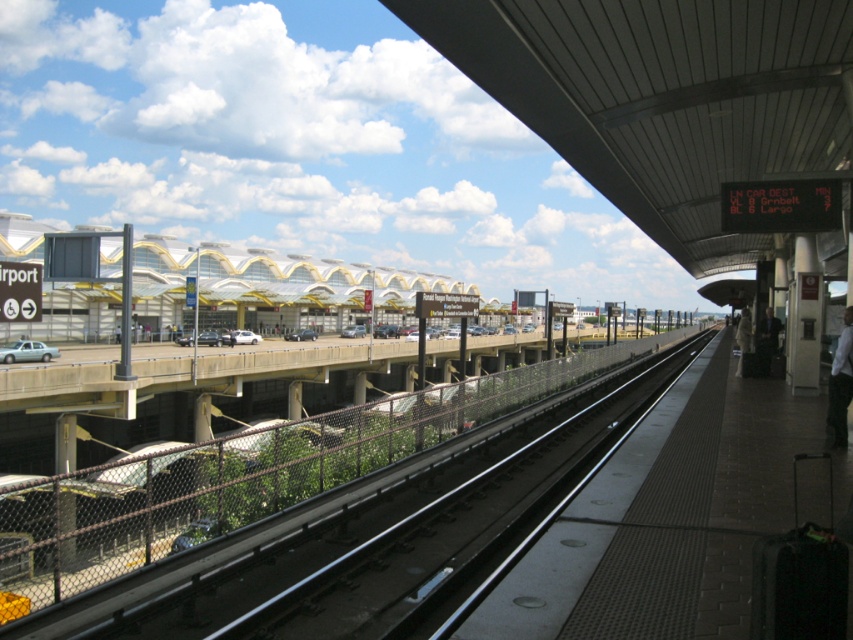
You are a passenger standing on the platform at Ronald Reagan Washington National Airport. You notice two items on the platform near the fence. One is a white shirt at right and the other is a white fabric bag at platform right. Which item is closer to the fence?

The white shirt at right is closer to the fence because it is positioned to the left of the white fabric bag at platform right, and since both are near the fence, the one further left would be nearer to the fence if the fence is on the right side of the platform as per the scene description.